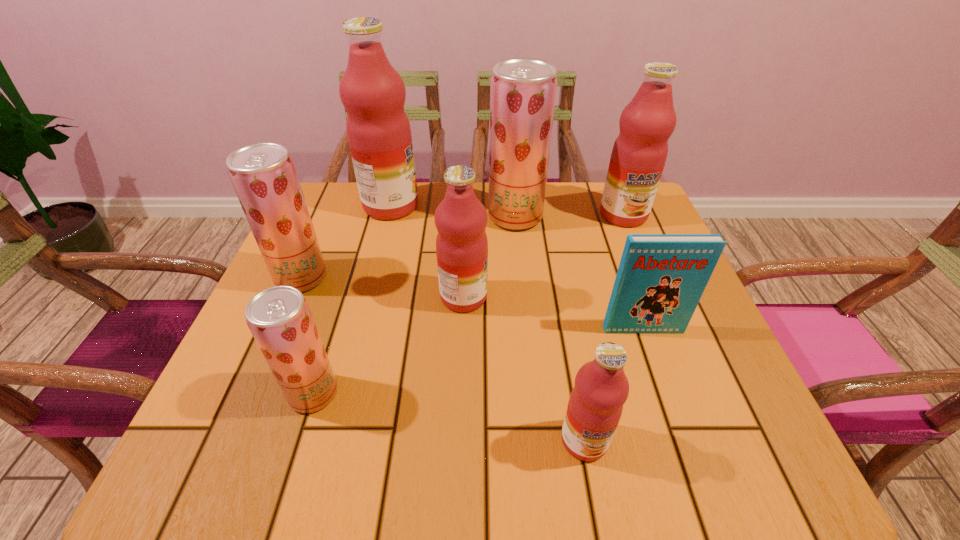
This screenshot has width=960, height=540. What are the coordinates of `vacant space at the right edge` in the screenshot? It's located at (605, 252).

At what (x,y) coordinates should I click in order to perform the action: click on free space at the far left corner. Please return your answer as a coordinate pair (x, y). Looking at the image, I should click on (320, 186).

Identify the location of free space that is in between the tallest object and the blue book. (517, 267).

Find the location of a particular element. The height and width of the screenshot is (540, 960). free space that is in between the second biggest strawberry fruit juice and the second nearest pink fruit juice is located at coordinates (382, 287).

Where is `free space that is in between the leftmost object and the third pink fruit juice from left to right`? This screenshot has width=960, height=540. free space that is in between the leftmost object and the third pink fruit juice from left to right is located at coordinates (443, 359).

This screenshot has height=540, width=960. I want to click on vacant region between the tallest object and the second farthest strawberry fruit juice, so click(347, 242).

This screenshot has width=960, height=540. I want to click on vacant area between the third nearest object and the fifth object from right to left, so click(x=553, y=313).

Find the location of a particular element. unoccupied position between the third nearest object and the farthest strawberry fruit juice is located at coordinates (579, 273).

You are a GUI agent. You are given a task and a screenshot of the screen. Output one action in this format:
    pyautogui.click(x=<x>, y=<y>)
    Task: Click on the free point between the second biggest strawberry fruit juice and the farthest strawberry fruit juice
    
    Given the screenshot: What is the action you would take?
    pyautogui.click(x=408, y=247)

The width and height of the screenshot is (960, 540). Identify the location of object that ranks as the fourth closest to the nearest object. (522, 98).